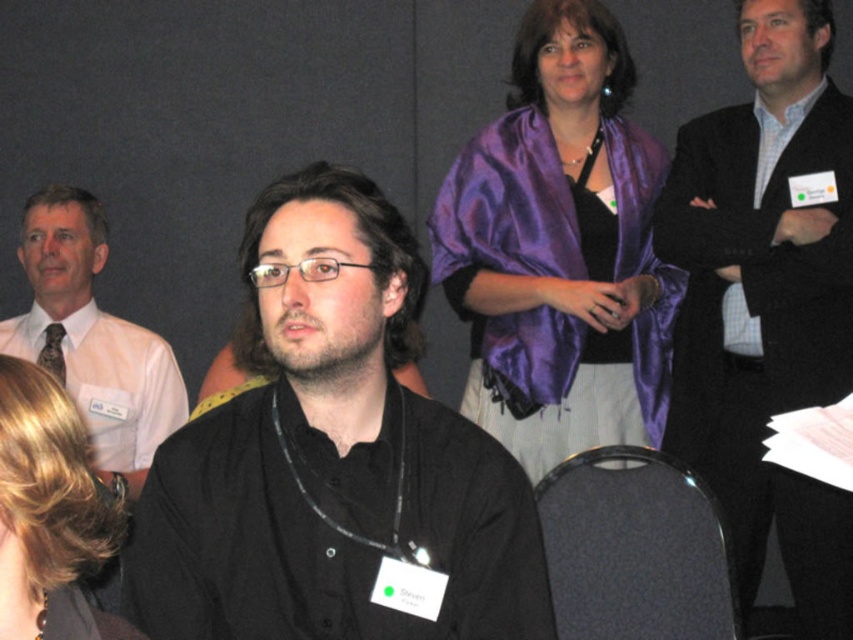
Which of these two, black fabric chair at lower center or blonde hair at lower left, stands shorter?

Standing shorter between the two is blonde hair at lower left.

How distant is black fabric chair at lower center from blonde hair at lower left?

black fabric chair at lower center is 38.69 inches from blonde hair at lower left.

Does point (712, 608) come in front of point (19, 579)?

No, it is not.

This screenshot has width=853, height=640. Identify the location of black fabric chair at lower center. (634, 548).

Is purple satin shawl at upper center to the left of matte white shirt at left from the viewer's perspective?

In fact, purple satin shawl at upper center is to the right of matte white shirt at left.

Can you confirm if purple satin shawl at upper center is wider than matte white shirt at left?

In fact, purple satin shawl at upper center might be narrower than matte white shirt at left.

Where is `purple satin shawl at upper center`? The image size is (853, 640). purple satin shawl at upper center is located at coordinates (560, 250).

Identify the location of purple satin shawl at upper center. (560, 250).

Is point (270, 579) positioned before point (572, 497)?

Yes, it is in front of point (572, 497).

What do you see at coordinates (334, 460) in the screenshot?
I see `black matte shirt at center` at bounding box center [334, 460].

The width and height of the screenshot is (853, 640). In order to click on black matte shirt at center in this screenshot , I will do `click(334, 460)`.